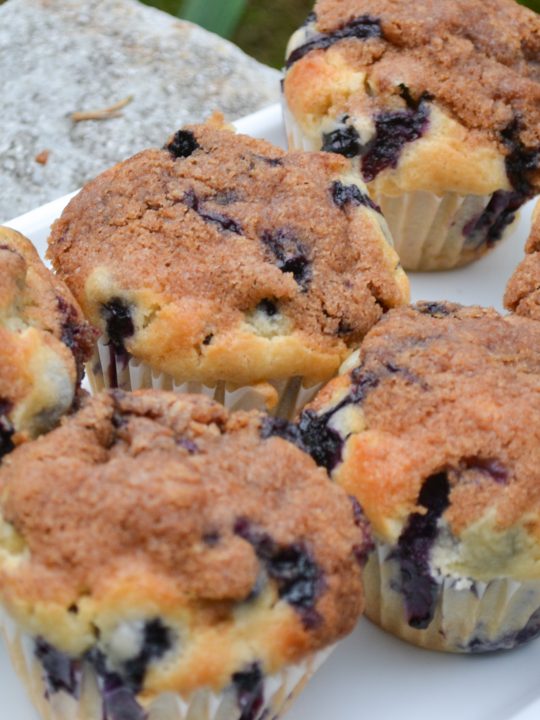
Locate an element on the screen. Image resolution: width=540 pixels, height=720 pixels. plate is located at coordinates (433, 672).